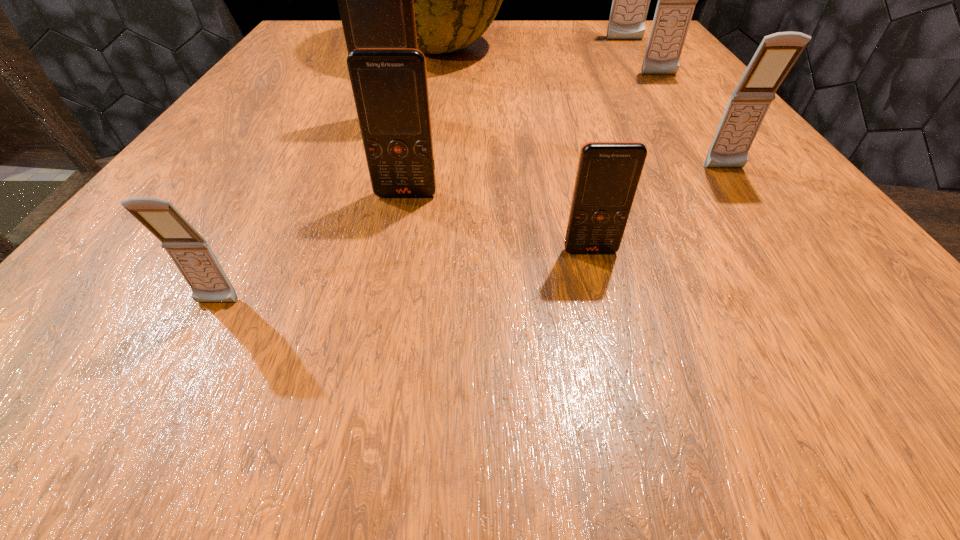
The image size is (960, 540). In order to click on the third nearest object in this screenshot , I will do `click(390, 87)`.

Locate an element on the screen. This screenshot has height=540, width=960. the second smallest orange cellular telephone is located at coordinates (390, 87).

Identify the location of the rightmost orange cellular telephone. This screenshot has height=540, width=960. (608, 173).

At what (x,y) coordinates should I click in order to perform the action: click on the fifth object from left to right. Please return your answer as a coordinate pair (x, y). The width and height of the screenshot is (960, 540). Looking at the image, I should click on (608, 173).

Find the location of `the nearest object`. the nearest object is located at coordinates (190, 252).

At what (x,y) coordinates should I click in order to perform the action: click on the leftmost gray cellular telephone. Please return your answer as a coordinate pair (x, y). Looking at the image, I should click on (190, 252).

Where is `vacant region located on the front of the watermelon`? Image resolution: width=960 pixels, height=540 pixels. vacant region located on the front of the watermelon is located at coordinates (420, 125).

Identify the location of free spot located 0.170m on the front-facing side of the farthest cellular telephone. (647, 74).

Identify the location of vacant point located on the front-facing side of the second farthest gray cellular telephone. The width and height of the screenshot is (960, 540). (705, 140).

At what (x,y) coordinates should I click in order to perform the action: click on free space located on the screen of the farthest orange cellular telephone. Please return your answer as a coordinate pair (x, y). The height and width of the screenshot is (540, 960). Looking at the image, I should click on (371, 197).